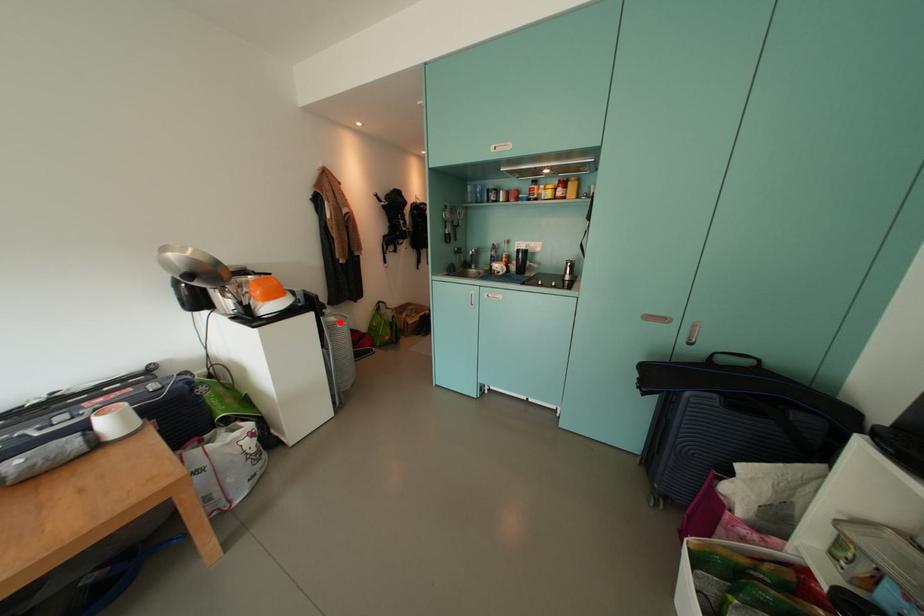
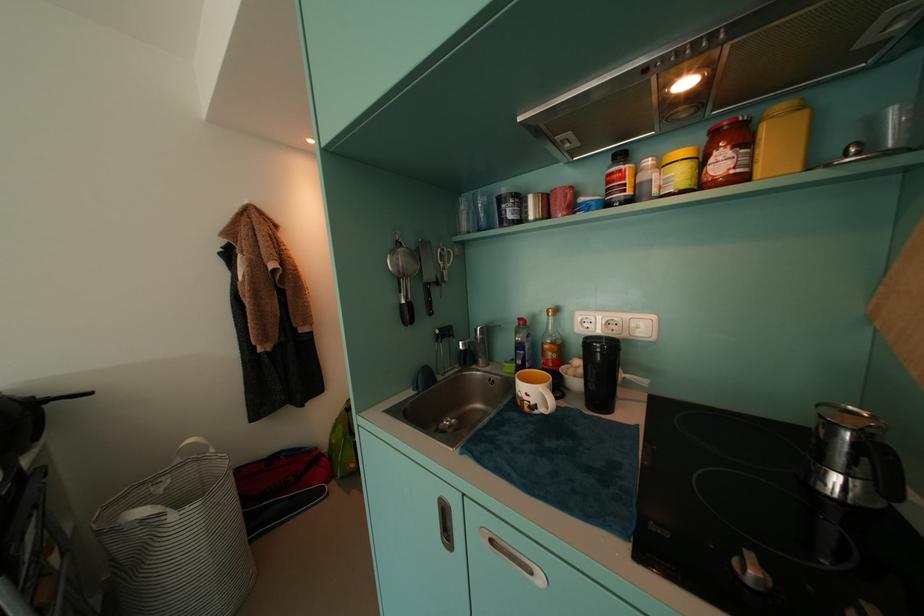
In the second image, find the point that corresponds to the highlighted location in the first image.

(149, 516)